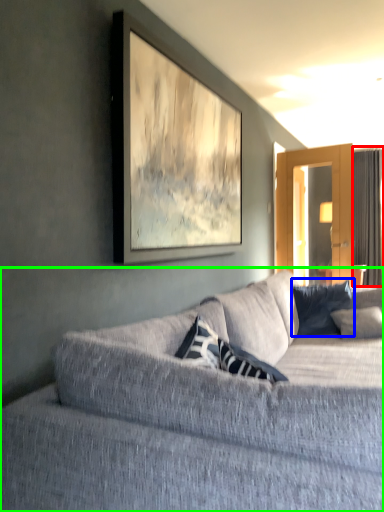
Question: Considering the real-world distances, which object is farthest from curtain (highlighted by a red box)? pillow (highlighted by a blue box) or studio couch (highlighted by a green box)?

Choices:
 (A) pillow
 (B) studio couch

Answer: (B)